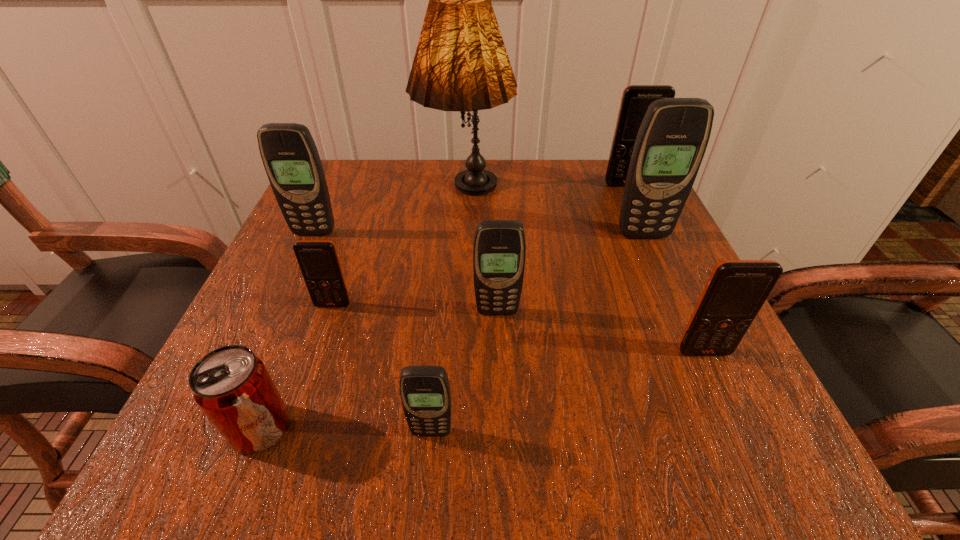
The width and height of the screenshot is (960, 540). In order to click on cellular telephone object that ranks as the fifth closest to the pop soda in this screenshot , I will do `click(736, 290)`.

Locate which gray cellular telephone is the third closest to the tallest object. Please provide its 2D coordinates. Your answer should be formatted as a tuple, i.e. [(x, y)], where the tuple contains the x and y coordinates of a point satisfying the conditions above.

[(499, 250)]

Choose which gray cellular telephone is the second nearest neighbor to the leftmost gray cellular telephone. Please provide its 2D coordinates. Your answer should be formatted as a tuple, i.e. [(x, y)], where the tuple contains the x and y coordinates of a point satisfying the conditions above.

[(425, 393)]

Identify the location of orange cellular telephone that can be found as the closest to the nearest cellular telephone. The image size is (960, 540). (318, 260).

Identify the location of the closest orange cellular telephone to the second biggest gray cellular telephone. The height and width of the screenshot is (540, 960). (318, 260).